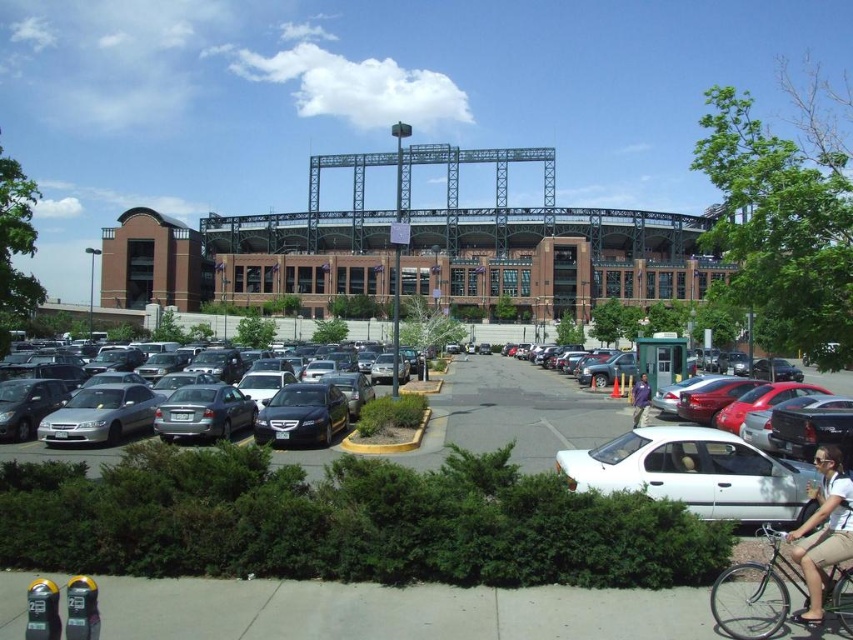
Between point (195, 394) and point (299, 433), which one is positioned in front?

Positioned in front is point (299, 433).

Is silver metallic sedan at left further to the viewer compared to satin black sedan at center?

No.

Who is more distant from viewer, (224,385) or (343,403)?

The point (343,403) is more distant.

Where is `silver metallic sedan at left`? silver metallic sedan at left is located at coordinates (155, 408).

Consider the image. Does silver metallic sedan at left appear on the right side of purple cotton shirt at lower right?

No, silver metallic sedan at left is not to the right of purple cotton shirt at lower right.

Which is more to the right, silver metallic sedan at left or purple cotton shirt at lower right?

From the viewer's perspective, purple cotton shirt at lower right appears more on the right side.

Between point (108, 388) and point (635, 401), which one is positioned behind?

Point (635, 401)

In order to click on silver metallic sedan at left in this screenshot , I will do `click(155, 408)`.

Between satin black sedan at center and purple cotton shirt at lower right, which one is positioned higher?

purple cotton shirt at lower right

Does satin black sedan at center have a lesser width compared to purple cotton shirt at lower right?

No.

Image resolution: width=853 pixels, height=640 pixels. I want to click on satin black sedan at center, so click(302, 416).